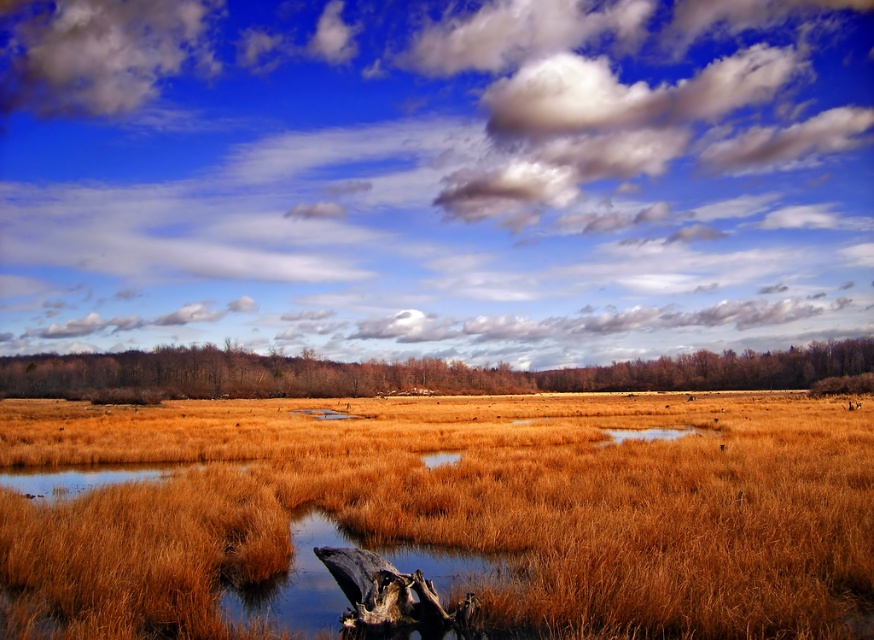
Question: Where is white fluffy cloud at upper center located in relation to brown matte tree at center in the image?

Choices:
 (A) above
 (B) below

Answer: (A)

Question: Which of the following is the farthest from the observer?

Choices:
 (A) white fluffy cloud at upper left
 (B) dark brown wood at lower center
 (C) white fluffy cloud at upper center
 (D) dry grass at center

Answer: (A)

Question: Can you confirm if white fluffy cloud at upper center is thinner than dark brown wood at lower center?

Choices:
 (A) yes
 (B) no

Answer: (B)

Question: Among these points, which one is farthest from the camera?

Choices:
 (A) (170, 12)
 (B) (357, 621)
 (C) (667, 570)
 (D) (143, 390)

Answer: (A)

Question: In this image, where is brown matte tree at center located relative to white fluffy cloud at upper left?

Choices:
 (A) below
 (B) above

Answer: (A)

Question: Which of the following is the closest to the observer?

Choices:
 (A) white fluffy cloud at upper left
 (B) dark brown wood at lower center
 (C) dry grass at center

Answer: (C)